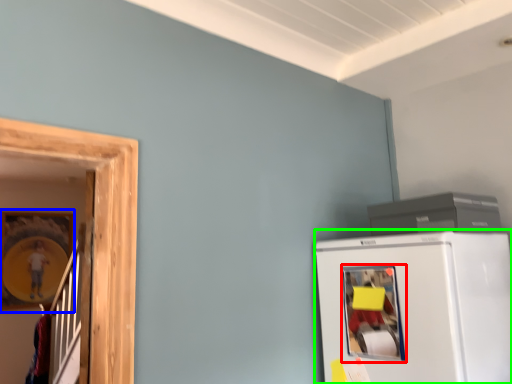
Question: Considering the real-world distances, which object is closest to window (highlighted by a red box)? picture frame (highlighted by a blue box) or refrigerator (highlighted by a green box).

Choices:
 (A) picture frame
 (B) refrigerator

Answer: (B)